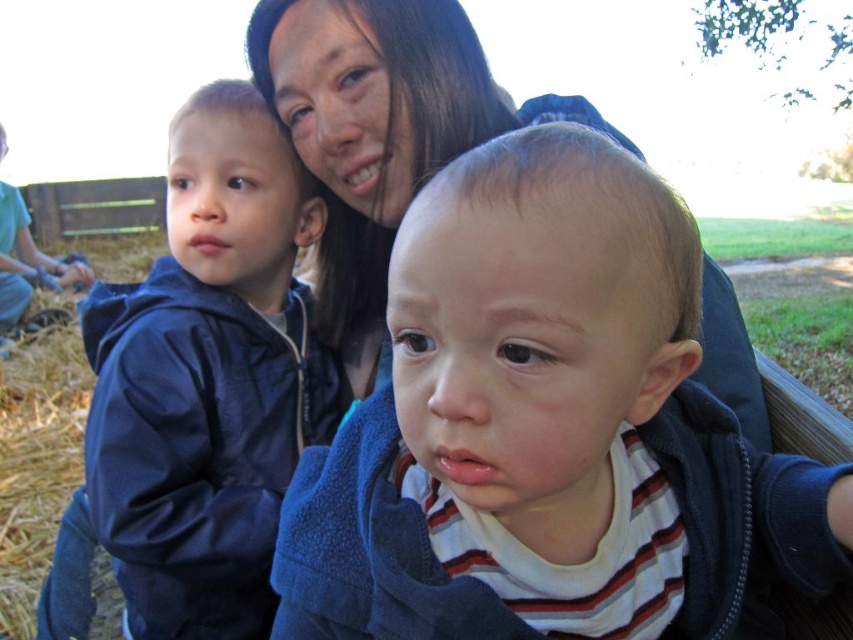
You are organizing a clothing donation drive and need to categorize the items based on size. You have two jackets in front of you, a matte blue hoodie at center and a dark blue jacket at left. Which one should you place in the small size bin?

The matte blue hoodie at center has a smaller size compared to the dark blue jacket at left, so it should be placed in the small size bin.

You are standing in the scene and want to find the dark blue jacket at left. Based on the coordinates provided, where should you look in the image?

The dark blue jacket at left is located at the 2D coordinates of point 0.592 on the x axis and 0.245 on the y axis.

What object is located at the coordinates point (544, 428)?

The point (544, 428) corresponds to the matte blue hoodie at center.